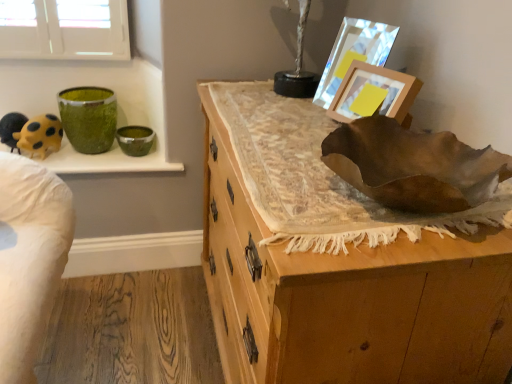
Question: In the image, is wooden chest of drawers at center positioned in front of or behind yellow matte toy at upper left?

Choices:
 (A) front
 (B) behind

Answer: (A)

Question: Considering the positions of wooden chest of drawers at center and yellow matte toy at upper left in the image, is wooden chest of drawers at center wider or thinner than yellow matte toy at upper left?

Choices:
 (A) wide
 (B) thin

Answer: (A)

Question: Which of these objects is positioned closest to the metallic reflective picture frame at upper right, which is counted as the 1th picture frame, starting from the back?

Choices:
 (A) green glossy bowl at upper left
 (B) green textured vase at upper left
 (C) wooden picture frame at upper right, the first picture frame positioned from the front
 (D) yellow matte toy at upper left
 (E) wooden chest of drawers at center

Answer: (C)

Question: Considering the real-world distances, which object is farthest from the green glossy bowl at upper left?

Choices:
 (A) wooden picture frame at upper right, the second picture frame from the back
 (B) green textured vase at upper left
 (C) metallic reflective picture frame at upper right, which appears as the 2th picture frame when viewed from the front
 (D) yellow matte toy at upper left
 (E) wooden chest of drawers at center

Answer: (E)